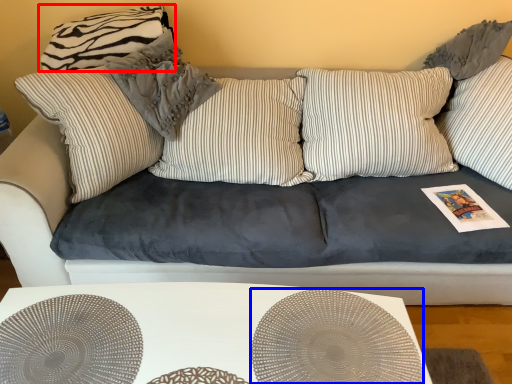
Question: Which object is closer to the camera taking this photo, pillow (highlighted by a red box) or circle (highlighted by a blue box)?

Choices:
 (A) pillow
 (B) circle

Answer: (B)